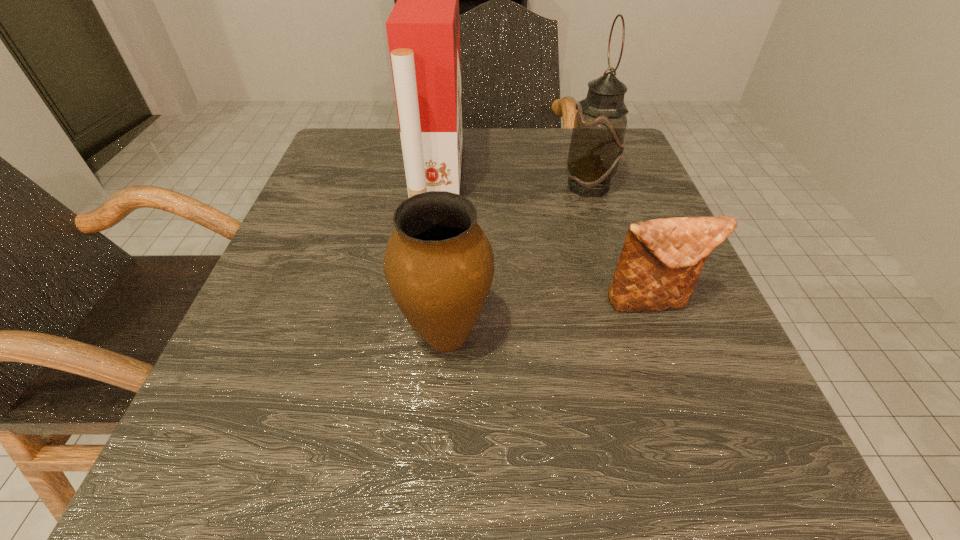
In order to click on free area in between the cigarette case and the oil lamp in this screenshot , I will do 514,183.

At what (x,y) coordinates should I click in order to perform the action: click on empty location between the oil lamp and the second shortest object. Please return your answer as a coordinate pair (x, y). Looking at the image, I should click on (517, 260).

This screenshot has width=960, height=540. Identify the location of free space between the cigarette case and the oil lamp. (514, 183).

Locate an element on the screen. free spot between the second shortest object and the oil lamp is located at coordinates (517, 260).

Locate an element on the screen. The width and height of the screenshot is (960, 540). free point between the urn and the oil lamp is located at coordinates (517, 260).

Where is `free area in between the second shortest object and the clutch bag`? This screenshot has height=540, width=960. free area in between the second shortest object and the clutch bag is located at coordinates (548, 319).

What are the coordinates of `free space between the shortest object and the urn` in the screenshot? It's located at (548, 319).

The image size is (960, 540). I want to click on empty location between the urn and the shortest object, so click(548, 319).

What are the coordinates of `blank region between the oil lamp and the shortest object` in the screenshot? It's located at (620, 245).

Locate an element on the screen. The image size is (960, 540). free spot between the oil lamp and the cigarette case is located at coordinates (514, 183).